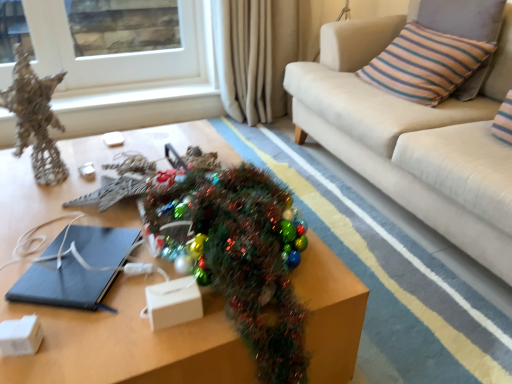
Question: Does point pyautogui.click(x=179, y=16) appear closer or farther from the camera than point pyautogui.click(x=48, y=92)?

Choices:
 (A) farther
 (B) closer

Answer: (A)

Question: From the image's perspective, is white glass window at upper left above or below metallic wire sculpture at left?

Choices:
 (A) below
 (B) above

Answer: (B)

Question: Which of these objects is positioned closest to the matte black notebook at center?

Choices:
 (A) metallic brown table at center
 (B) striped fabric pillow at upper right
 (C) beige fabric couch at upper right
 (D) beige fabric curtain at upper center
 (E) shiny metallic christmas tree at center

Answer: (E)

Question: Which is farther from the beige fabric curtain at upper center?

Choices:
 (A) shiny metallic christmas tree at center
 (B) striped fabric pillow at upper right
 (C) metallic wire sculpture at left
 (D) white glass window at upper left
 (E) matte black notebook at center

Answer: (E)